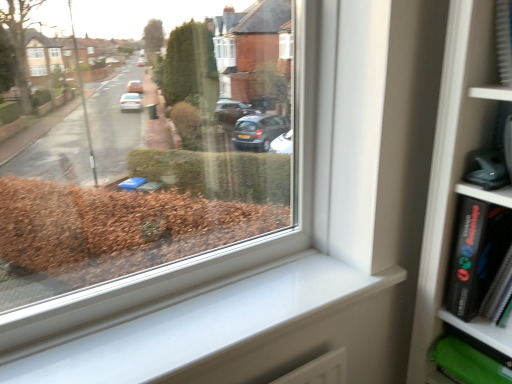
The image size is (512, 384). What do you see at coordinates (233, 331) in the screenshot?
I see `white smooth window sill at lower right` at bounding box center [233, 331].

What are the coordinates of `white smooth window sill at lower right` in the screenshot? It's located at (233, 331).

Identify the location of black matte book at right. (469, 259).

Describe the element at coordinates (469, 259) in the screenshot. I see `black matte book at right` at that location.

The height and width of the screenshot is (384, 512). I want to click on white smooth window sill at lower right, so click(x=233, y=331).

In the scene shown: Considering the positions of objects white smooth window sill at lower right and black matte book at right in the image provided, who is more to the right, white smooth window sill at lower right or black matte book at right?

From the viewer's perspective, black matte book at right appears more on the right side.

Relative to black matte book at right, is white smooth window sill at lower right in front or behind?

Clearly, white smooth window sill at lower right is in front of black matte book at right.

Is point (208, 341) positioned before point (473, 264)?

Yes, it is.

From the image's perspective, does white smooth window sill at lower right appear lower than black matte book at right?

Correct, white smooth window sill at lower right appears lower than black matte book at right in the image.

From a real-world perspective, is white smooth window sill at lower right physically located above or below black matte book at right?

From a real-world perspective, white smooth window sill at lower right is physically below black matte book at right.

Which object is thinner, white smooth window sill at lower right or black matte book at right?

black matte book at right is thinner.

Considering the relative sizes of white smooth window sill at lower right and black matte book at right in the image provided, is white smooth window sill at lower right shorter than black matte book at right?

Indeed, white smooth window sill at lower right has a lesser height compared to black matte book at right.

Looking at the image, does white smooth window sill at lower right seem bigger or smaller compared to black matte book at right?

white smooth window sill at lower right is bigger than black matte book at right.

From the picture: Is white smooth window sill at lower right spatially inside black matte book at right, or outside of it?

The correct answer is: outside.

Is white smooth window sill at lower right with black matte book at right?

white smooth window sill at lower right and black matte book at right are not in contact.

Could you tell me if white smooth window sill at lower right is turned towards black matte book at right?

No, white smooth window sill at lower right is not aimed at black matte book at right.

The width and height of the screenshot is (512, 384). I want to click on window sill below the black matte book at right (from a real-world perspective), so click(x=233, y=331).

Which object is positioned more to the right, black matte book at right or white smooth window sill at lower right?

black matte book at right is more to the right.

Relative to white smooth window sill at lower right, is black matte book at right in front or behind?

black matte book at right is behind white smooth window sill at lower right.

Does point (461, 203) appear closer or farther from the camera than point (307, 295)?

Point (461, 203) appears to be closer to the viewer than point (307, 295).

From the image's perspective, which one is positioned lower, black matte book at right or white smooth window sill at lower right?

white smooth window sill at lower right appears lower in the image.

From a real-world perspective, is black matte book at right positioned over white smooth window sill at lower right based on gravity?

Yes, from a real-world perspective, black matte book at right is over white smooth window sill at lower right

Is black matte book at right wider or thinner than white smooth window sill at lower right?

black matte book at right is thinner than white smooth window sill at lower right.

Considering the sizes of objects black matte book at right and white smooth window sill at lower right in the image provided, who is taller, black matte book at right or white smooth window sill at lower right?

black matte book at right.

Which of these two, black matte book at right or white smooth window sill at lower right, is smaller?

black matte book at right is smaller.

In the scene shown: Is white smooth window sill at lower right inside black matte book at right?

Actually, white smooth window sill at lower right is outside black matte book at right.

From the picture: Is black matte book at right positioned far away from white smooth window sill at lower right?

No, black matte book at right is in close proximity to white smooth window sill at lower right.

Could you tell me if black matte book at right is facing white smooth window sill at lower right?

No, black matte book at right is not aimed at white smooth window sill at lower right.

How many degrees apart are the facing directions of black matte book at right and white smooth window sill at lower right?

89.6 degrees.

Find the location of `window sill that is in front of the black matte book at right`. window sill that is in front of the black matte book at right is located at coordinates pyautogui.click(x=233, y=331).

At what (x,y) coordinates should I click in order to perform the action: click on paperback book above the white smooth window sill at lower right (from the image's perspective). Please return your answer as a coordinate pair (x, y). Looking at the image, I should click on (469, 259).

In order to click on paperback book to the right of white smooth window sill at lower right in this screenshot , I will do `click(469, 259)`.